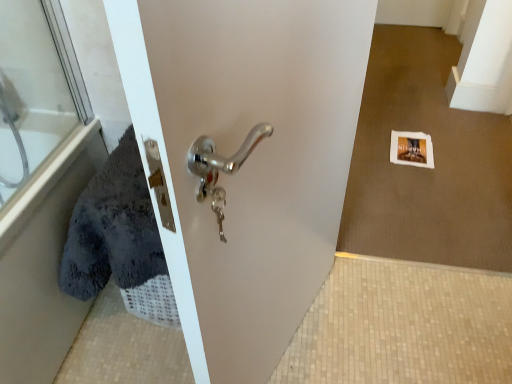
What is the approximate width of transparent glass door at upper left?

It is 28.09 centimeters.

Describe the element at coordinates (36, 92) in the screenshot. The width and height of the screenshot is (512, 384). I see `transparent glass door at upper left` at that location.

Measure the distance between transparent glass door at upper left and camera.

The depth of transparent glass door at upper left is 3.46 feet.

Locate an element on the screen. This screenshot has width=512, height=384. transparent glass door at upper left is located at coordinates (36, 92).

Where is `soft gray towel at left`? This screenshot has height=384, width=512. soft gray towel at left is located at coordinates (42, 262).

The image size is (512, 384). What do you see at coordinates (42, 262) in the screenshot?
I see `soft gray towel at left` at bounding box center [42, 262].

Identify the location of transparent glass door at upper left. This screenshot has width=512, height=384. (36, 92).

Considering the relative positions of transparent glass door at upper left and soft gray towel at left in the image provided, is transparent glass door at upper left to the left of soft gray towel at left from the viewer's perspective?

Incorrect, transparent glass door at upper left is not on the left side of soft gray towel at left.

In the scene shown: Who is more distant, transparent glass door at upper left or soft gray towel at left?

Positioned behind is transparent glass door at upper left.

Considering the positions of point (4, 75) and point (33, 288), is point (4, 75) closer or farther from the camera than point (33, 288)?

Point (4, 75) appears to be farther away from the viewer than point (33, 288).

From the picture: From the image's perspective, is transparent glass door at upper left on top of soft gray towel at left?

Indeed, from the image's perspective, transparent glass door at upper left is shown above soft gray towel at left.

From a real-world perspective, is transparent glass door at upper left located higher than soft gray towel at left?

Yes, from a real-world perspective, transparent glass door at upper left is on top of soft gray towel at left.

Which object is wider, transparent glass door at upper left or soft gray towel at left?

Wider between the two is soft gray towel at left.

In terms of height, does transparent glass door at upper left look taller or shorter compared to soft gray towel at left?

In the image, transparent glass door at upper left appears to be shorter than soft gray towel at left.

Based on the photo, between transparent glass door at upper left and soft gray towel at left, which one has larger size?

With larger size is soft gray towel at left.

Choose the correct answer: Is transparent glass door at upper left inside soft gray towel at left or outside it?

transparent glass door at upper left is located inside soft gray towel at left.

Is transparent glass door at upper left next to soft gray towel at left?

No, transparent glass door at upper left is not with soft gray towel at left.

Is transparent glass door at upper left turned away from soft gray towel at left?

That's right, transparent glass door at upper left is facing away from soft gray towel at left.

How many degrees apart are the facing directions of transparent glass door at upper left and soft gray towel at left?

The angle between the facing direction of transparent glass door at upper left and the facing direction of soft gray towel at left is 90.7 degrees.

I want to click on bath located on the left of transparent glass door at upper left, so click(x=42, y=262).

Looking at this image, is soft gray towel at left to the right of transparent glass door at upper left from the viewer's perspective?

No, soft gray towel at left is not to the right of transparent glass door at upper left.

Is soft gray towel at left in front of transparent glass door at upper left?

Yes, soft gray towel at left is closer to the viewer.

Considering the points (4, 300) and (1, 78), which point is in front, point (4, 300) or point (1, 78)?

The point (4, 300) is closer.

From the image's perspective, does soft gray towel at left appear lower than transparent glass door at upper left?

Yes, from the image's perspective, soft gray towel at left is beneath transparent glass door at upper left.

Based on the photo, from a real-world perspective, who is located higher, soft gray towel at left or transparent glass door at upper left?

In real-world perspective, transparent glass door at upper left is above.

Consider the image. Considering the sizes of objects soft gray towel at left and transparent glass door at upper left in the image provided, who is thinner, soft gray towel at left or transparent glass door at upper left?

transparent glass door at upper left.

Can you confirm if soft gray towel at left is taller than transparent glass door at upper left?

Yes, soft gray towel at left is taller than transparent glass door at upper left.

Does soft gray towel at left have a larger size compared to transparent glass door at upper left?

Indeed, soft gray towel at left has a larger size compared to transparent glass door at upper left.

Is soft gray towel at left outside of transparent glass door at upper left?

Yes, soft gray towel at left is not within transparent glass door at upper left.

Would you consider soft gray towel at left to be distant from transparent glass door at upper left?

No.

Is soft gray towel at left positioned with its back to transparent glass door at upper left?

Absolutely, soft gray towel at left is directed away from transparent glass door at upper left.

How many degrees apart are the facing directions of soft gray towel at left and transparent glass door at upper left?

90.7 degrees separate the facing orientations of soft gray towel at left and transparent glass door at upper left.

At what (x,y) coordinates should I click in order to perform the action: click on bath below the transparent glass door at upper left (from a real-world perspective). Please return your answer as a coordinate pair (x, y). Looking at the image, I should click on (42, 262).

At what (x,y) coordinates should I click in order to perform the action: click on glass door on the right side of soft gray towel at left. Please return your answer as a coordinate pair (x, y). Looking at the image, I should click on (36, 92).

Find the location of a particular element. This screenshot has width=512, height=384. glass door that is above the soft gray towel at left (from a real-world perspective) is located at coordinates (36, 92).